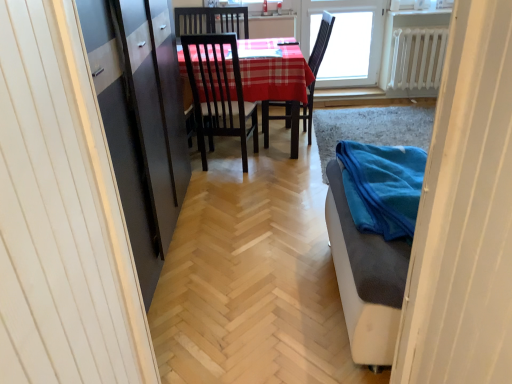
Question: From a real-world perspective, is transparent glass window at upper center on top of white metallic radiator at upper right?

Choices:
 (A) yes
 (B) no

Answer: (A)

Question: Does transparent glass window at upper center have a greater height compared to white metallic radiator at upper right?

Choices:
 (A) yes
 (B) no

Answer: (A)

Question: Does transparent glass window at upper center appear on the right side of white metallic radiator at upper right?

Choices:
 (A) no
 (B) yes

Answer: (A)

Question: Is transparent glass window at upper center positioned behind white metallic radiator at upper right?

Choices:
 (A) yes
 (B) no

Answer: (A)

Question: From a real-world perspective, is transparent glass window at upper center physically below white metallic radiator at upper right?

Choices:
 (A) yes
 (B) no

Answer: (B)

Question: Is white metallic radiator at upper right a part of transparent glass window at upper center?

Choices:
 (A) yes
 (B) no

Answer: (B)

Question: Is white metallic radiator at upper right far from transparent glass window at upper center?

Choices:
 (A) yes
 (B) no

Answer: (B)

Question: From a real-world perspective, does white metallic radiator at upper right stand above transparent glass window at upper center?

Choices:
 (A) no
 (B) yes

Answer: (A)

Question: Is white metallic radiator at upper right positioned before transparent glass window at upper center?

Choices:
 (A) no
 (B) yes

Answer: (B)

Question: Does white metallic radiator at upper right appear on the left side of transparent glass window at upper center?

Choices:
 (A) yes
 (B) no

Answer: (B)

Question: From the image's perspective, is white metallic radiator at upper right under transparent glass window at upper center?

Choices:
 (A) yes
 (B) no

Answer: (A)

Question: Is white metallic radiator at upper right oriented away from transparent glass window at upper center?

Choices:
 (A) yes
 (B) no

Answer: (B)

Question: From a real-world perspective, is transparent glass window at upper center positioned under blue fabric at lower right based on gravity?

Choices:
 (A) no
 (B) yes

Answer: (A)